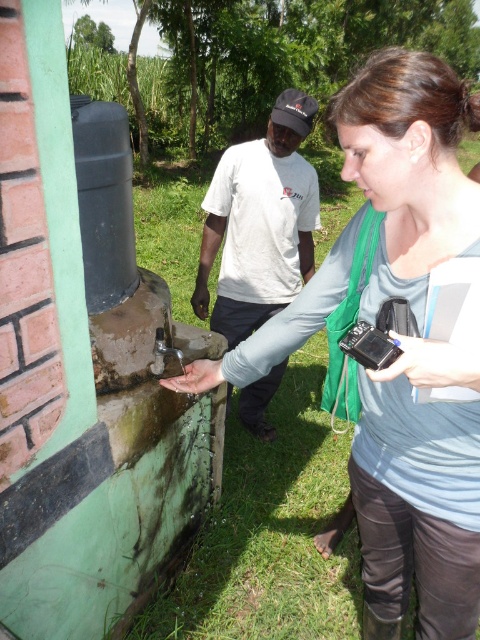
Question: Is matte gray shirt at center to the right of white cotton shirt at center from the viewer's perspective?

Choices:
 (A) yes
 (B) no

Answer: (A)

Question: Can you confirm if matte gray shirt at center is positioned to the right of white cotton shirt at center?

Choices:
 (A) no
 (B) yes

Answer: (B)

Question: Which point is closer to the camera taking this photo?

Choices:
 (A) (444, 554)
 (B) (252, 301)

Answer: (A)

Question: Which point is farther from the camera taking this photo?

Choices:
 (A) (271, 355)
 (B) (218, 280)

Answer: (B)

Question: Among these objects, which one is nearest to the camera?

Choices:
 (A) white cotton shirt at center
 (B) matte gray shirt at center

Answer: (B)

Question: From the image, what is the correct spatial relationship of matte gray shirt at center in relation to white cotton shirt at center?

Choices:
 (A) below
 (B) above

Answer: (A)